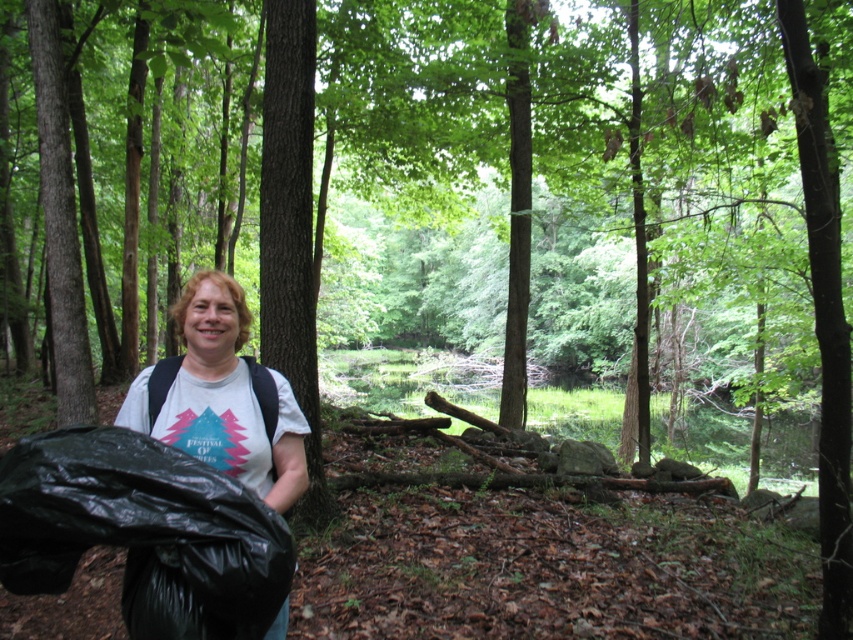
You are a drone operator tasked with dropping a supply package to the person in the wooded area. The package must land precisely at the location of the black plastic bag at lower left. Given that the drone uses a coordinate system where the bottom left corner of the image is the origin point, can you confirm the exact coordinates where the package should be dropped?

The black plastic bag at lower left is located at point (143,532), so the package should be dropped at those coordinates to reach the correct location.

You are standing in a wooded area and want to reach a specific point to place a marker. The point is located at coordinates point (1, 529). If your arm can reach up to 1.6 meters, can you place the marker without moving closer?

The distance of point (1, 529) from camera is 1.56 meters, so yes, you can place the marker without moving closer since the distance is within your arm reach of 1.6 meters.